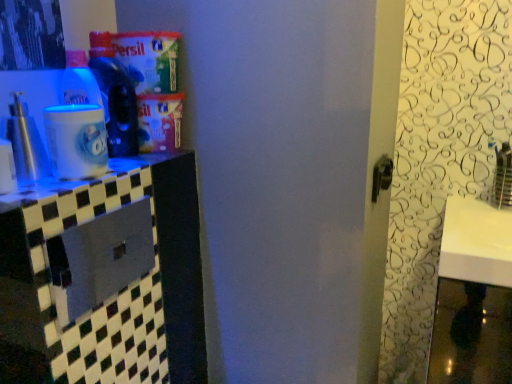
Question: Would you say metallic silver spray at left, the second bottle when ordered from back to front, contains metallic gray drawer at left?

Choices:
 (A) no
 (B) yes

Answer: (A)

Question: From a real-world perspective, is metallic silver spray at left, the 1th bottle when ordered from left to right, physically above metallic gray drawer at left?

Choices:
 (A) no
 (B) yes

Answer: (B)

Question: Is metallic silver spray at left, the 1th bottle when ordered from left to right, bigger than metallic gray drawer at left?

Choices:
 (A) no
 (B) yes

Answer: (A)

Question: From a real-world perspective, does metallic silver spray at left, the 1th bottle when ordered from left to right, sit lower than metallic gray drawer at left?

Choices:
 (A) yes
 (B) no

Answer: (B)

Question: Can you confirm if metallic silver spray at left, the second bottle when ordered from back to front, is wider than metallic gray drawer at left?

Choices:
 (A) yes
 (B) no

Answer: (A)

Question: Would you say white glossy counter top at left is inside or outside metallic gray drawer at left?

Choices:
 (A) outside
 (B) inside

Answer: (A)

Question: Considering the positions of white glossy counter top at left and metallic gray drawer at left in the image, is white glossy counter top at left bigger or smaller than metallic gray drawer at left?

Choices:
 (A) small
 (B) big

Answer: (A)

Question: From a real-world perspective, relative to metallic gray drawer at left, is white glossy counter top at left vertically above or below?

Choices:
 (A) above
 (B) below

Answer: (A)

Question: Considering the positions of white glossy counter top at left and metallic gray drawer at left in the image, is white glossy counter top at left wider or thinner than metallic gray drawer at left?

Choices:
 (A) wide
 (B) thin

Answer: (A)

Question: Relative to white glossy counter top at left, is metallic gray drawer at left in front or behind?

Choices:
 (A) front
 (B) behind

Answer: (B)

Question: Is point (68, 249) closer or farther from the camera than point (118, 192)?

Choices:
 (A) farther
 (B) closer

Answer: (A)

Question: In terms of size, does metallic gray drawer at left appear bigger or smaller than white glossy counter top at left?

Choices:
 (A) small
 (B) big

Answer: (B)

Question: From a real-world perspective, relative to white glossy counter top at left, is metallic gray drawer at left vertically above or below?

Choices:
 (A) above
 (B) below

Answer: (B)

Question: In the image, is translucent plastic bottle at upper left, the second bottle in the left-to-right sequence, on the left side or the right side of metallic silver spray at left, the first bottle when ordered from front to back?

Choices:
 (A) right
 (B) left

Answer: (A)

Question: Do you think translucent plastic bottle at upper left, which is the 2th bottle in front-to-back order, is within metallic silver spray at left, the first bottle when ordered from front to back, or outside of it?

Choices:
 (A) inside
 (B) outside

Answer: (B)